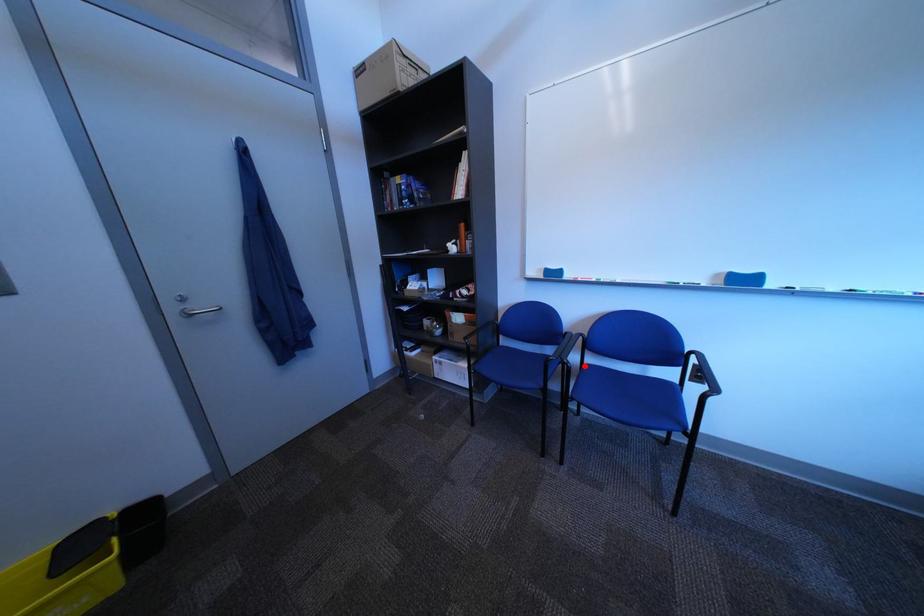
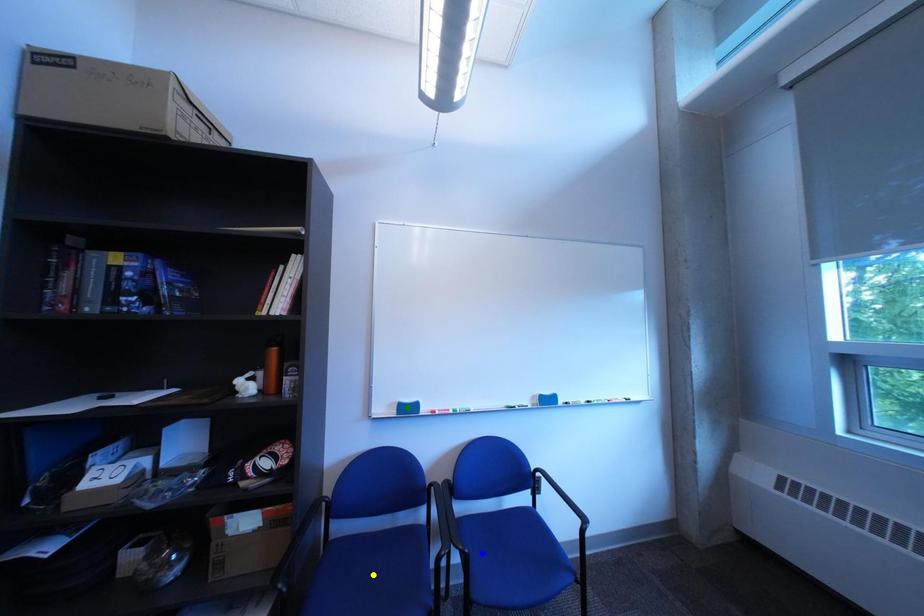
Question: I am providing you with two images of the same scene from different viewpoints. A red point is marked on the first image. You are given multiple points on the second image. Which point in image 2 represents the same 3d spot as the red point in image 1?

Choices:
 (A) green point
 (B) yellow point
 (C) blue point

Answer: (C)